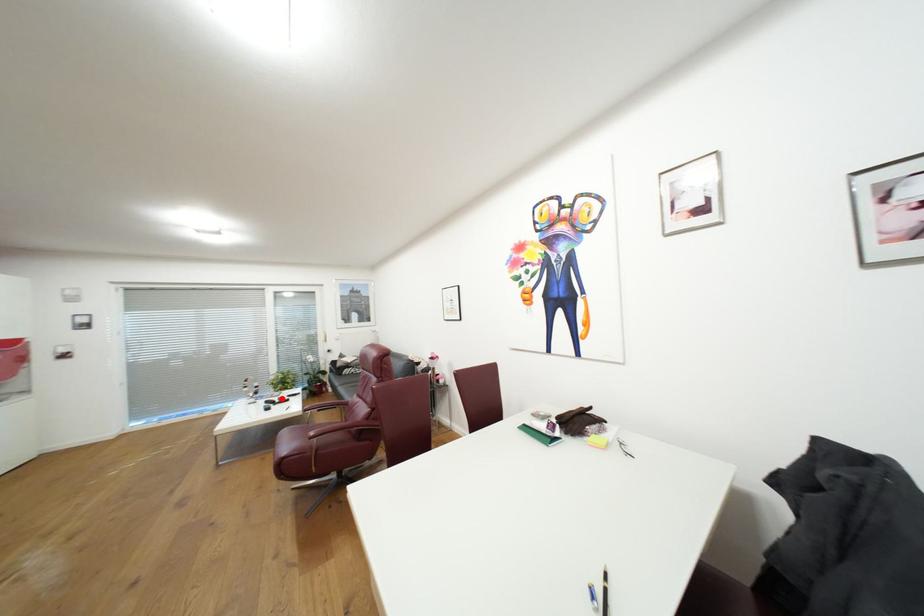
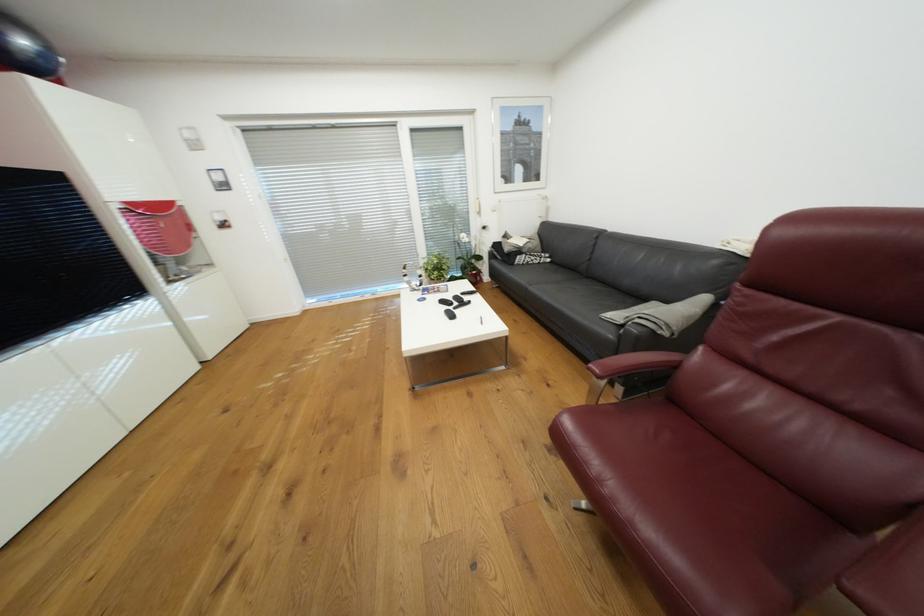
Locate, in the second image, the point that corresponds to the highlighted location in the first image.

(456, 297)